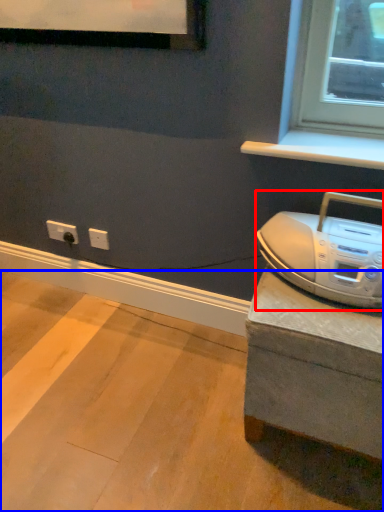
Question: Which object is further to the camera taking this photo, home appliance (highlighted by a red box) or concrete (highlighted by a blue box)?

Choices:
 (A) home appliance
 (B) concrete

Answer: (A)